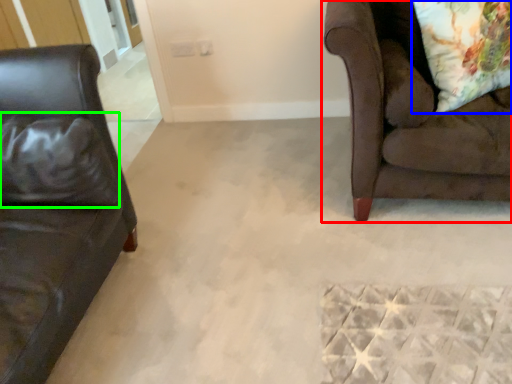
Question: Which object is positioned farthest from studio couch (highlighted by a red box)? Select from throw pillow (highlighted by a blue box) and pillow (highlighted by a green box).

Choices:
 (A) throw pillow
 (B) pillow

Answer: (B)